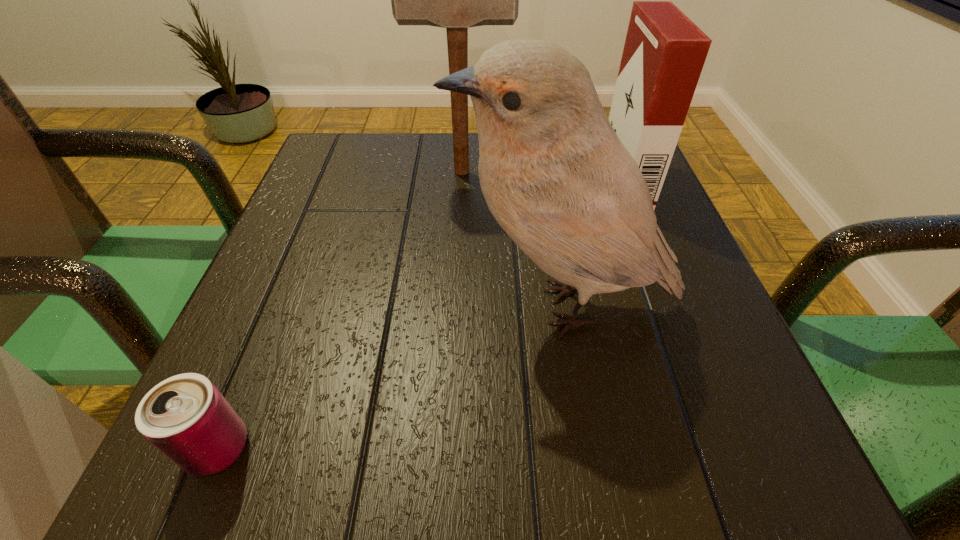
The image size is (960, 540). In the image, there is a desktop. What are the coordinates of `vacant space at the far edge` in the screenshot? It's located at (434, 168).

In the image, there is a desktop. In order to click on vacant space at the near edge in this screenshot , I will do `click(457, 424)`.

Where is `vacant space at the left edge`? vacant space at the left edge is located at coordinates (239, 318).

Identify the location of blank space at the right edge of the desktop. (646, 292).

Locate an element on the screen. vacant space at the far left corner of the desktop is located at coordinates pos(364,146).

At what (x,y) coordinates should I click in order to perform the action: click on free space at the near right corner. Please return your answer as a coordinate pair (x, y). The width and height of the screenshot is (960, 540). Looking at the image, I should click on (732, 490).

Where is `free spot between the nearest object and the second shortest object`? free spot between the nearest object and the second shortest object is located at coordinates (421, 315).

The image size is (960, 540). In order to click on vacant region between the mallet and the parakeet in this screenshot , I will do `click(512, 240)`.

This screenshot has width=960, height=540. In order to click on free space between the can and the parakeet in this screenshot , I will do `click(390, 377)`.

At what (x,y) coordinates should I click in order to perform the action: click on vacant space that is in between the third farthest object and the mallet. Please return your answer as a coordinate pair (x, y). This screenshot has height=540, width=960. Looking at the image, I should click on (512, 240).